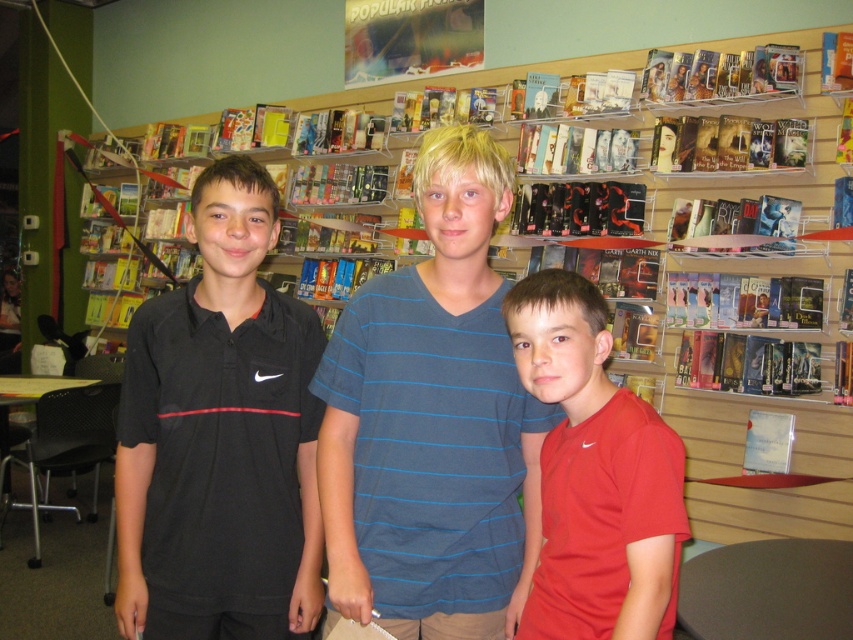
You are standing in a bookstore and want to take a photo of the point at coordinates point (431, 378). If you are currently 4.64 feet away from the point, should you move closer or farther away to capture the point in your photo?

The point (431, 378) is 4.64 feet away from the camera. Since you are already at the correct distance, you don not need to move closer or farther away to capture the point in your photo.

You are a photographer trying to focus on the blue striped shirt at center. What are the coordinates where you should aim your camera?

The coordinates to focus on the blue striped shirt at center are at point (433, 420).

Based on the scene description, where is the blue striped shirt at center located in terms of its 2D coordinates?

The blue striped shirt at center is located at the 2D coordinates of point (433,420).